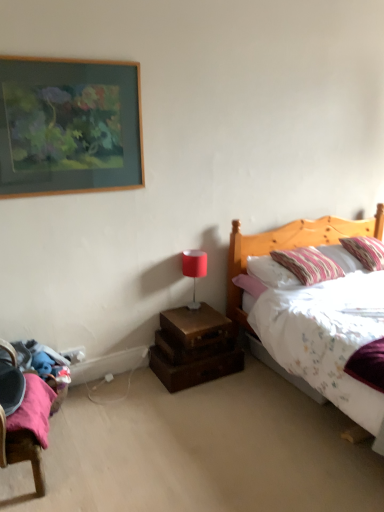
Identify the location of free space in front of matte red lamp at center. The width and height of the screenshot is (384, 512). (192, 320).